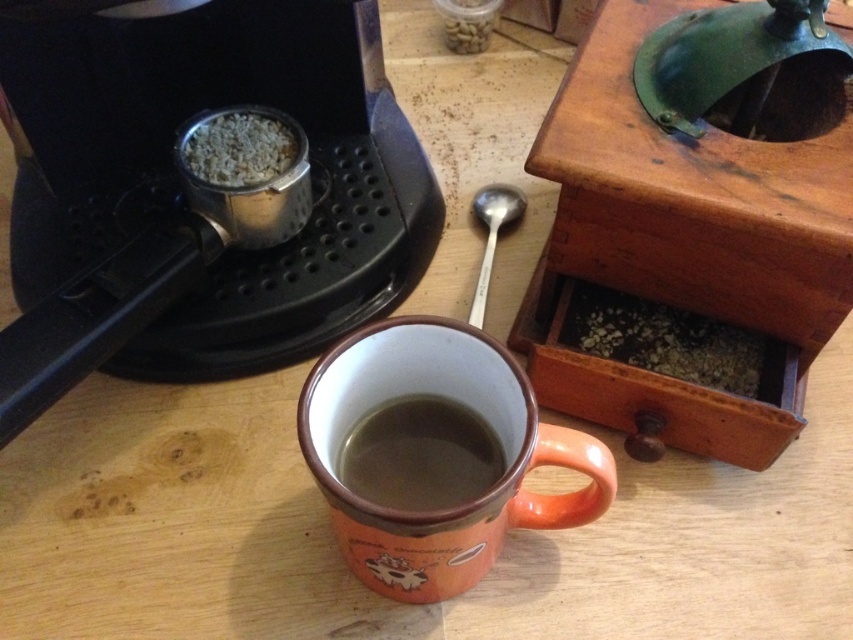
Question: Which of the following is the farthest from the observer?

Choices:
 (A) black plastic coffee machine at upper left
 (B) brown matte mug at center

Answer: (A)

Question: Is black plastic coffee machine at upper left thinner than silver metallic spoon at center?

Choices:
 (A) no
 (B) yes

Answer: (A)

Question: Is black plastic coffee machine at upper left below silver metallic spoon at center?

Choices:
 (A) no
 (B) yes

Answer: (A)

Question: Does black plastic coffee machine at upper left appear over orange ceramic mug at center?

Choices:
 (A) yes
 (B) no

Answer: (A)

Question: Among these points, which one is farthest from the camera?

Choices:
 (A) (514, 419)
 (B) (148, 301)
 (C) (572, 141)
 (D) (488, 435)

Answer: (B)

Question: Among these points, which one is nearest to the camera?

Choices:
 (A) pyautogui.click(x=473, y=301)
 (B) pyautogui.click(x=488, y=467)
 (C) pyautogui.click(x=397, y=410)

Answer: (B)